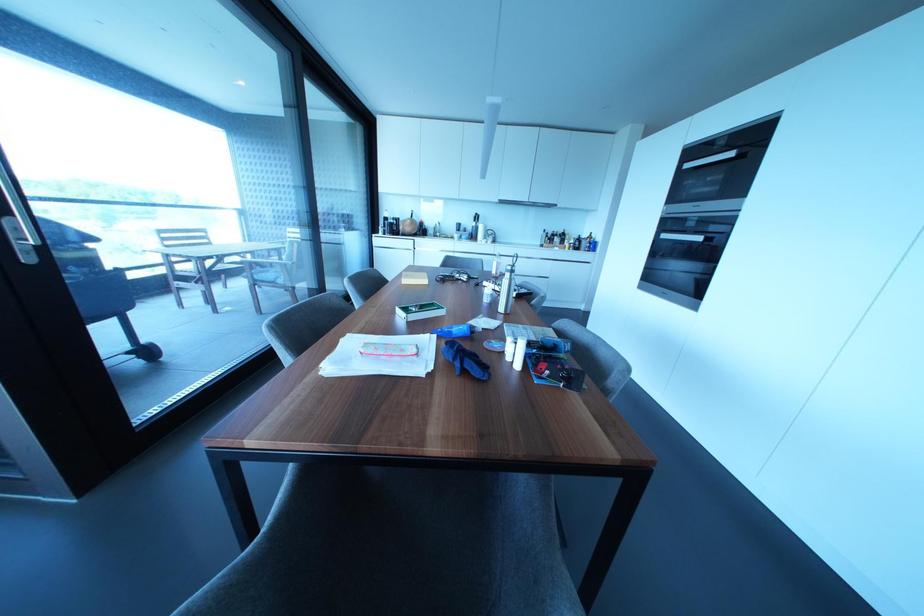
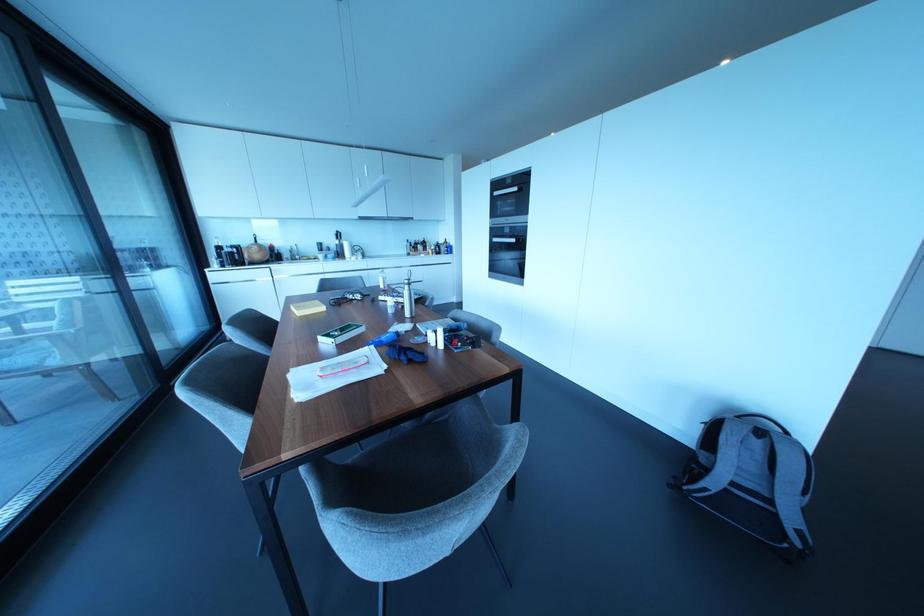
The point at (x=464, y=277) is marked in the first image. Where is the corresponding point in the second image?

(358, 296)